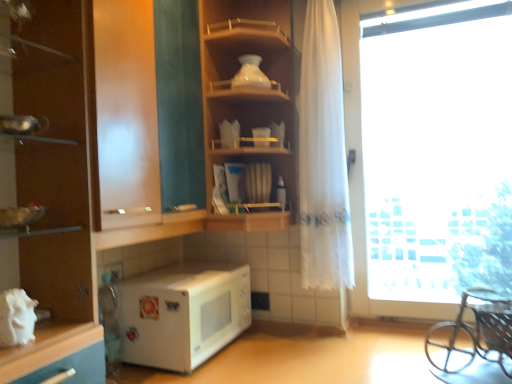
Question: Considering the positions of transparent glass window at right and matte brown cabinet at left in the image, is transparent glass window at right bigger or smaller than matte brown cabinet at left?

Choices:
 (A) big
 (B) small

Answer: (B)

Question: Relative to matte brown cabinet at left, is transparent glass window at right in front or behind?

Choices:
 (A) behind
 (B) front

Answer: (A)

Question: Which of these objects is positioned farthest from the white matte microwave at lower left?

Choices:
 (A) wooden shelf at center, which ranks as the 2th shelf in left-to-right order
 (B) metallic silver baby carriage at lower right
 (C) transparent glass shelves at upper left, marked as the first shelf in a left-to-right arrangement
 (D) white sheer curtain at right
 (E) transparent glass window at right

Answer: (B)

Question: Which is farther from the wooden shelf at center, which appears as the first shelf when viewed from the right?

Choices:
 (A) white matte microwave at lower left
 (B) metallic silver baby carriage at lower right
 (C) white sheer curtain at right
 (D) transparent glass window at right
 (E) white glossy vase at upper center

Answer: (B)